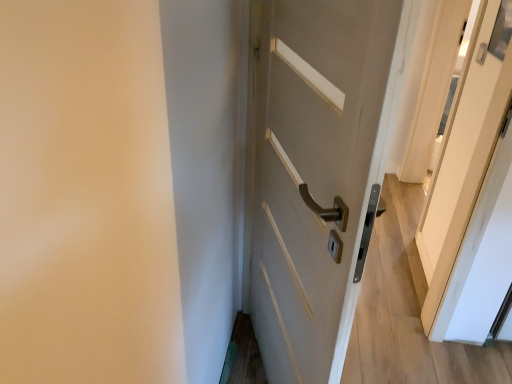
Question: Is white glossy screen door at upper right at the left side of matte white door at center?

Choices:
 (A) yes
 (B) no

Answer: (B)

Question: From a real-world perspective, does white glossy screen door at upper right sit lower than matte white door at center?

Choices:
 (A) no
 (B) yes

Answer: (B)

Question: Is white glossy screen door at upper right surrounding matte white door at center?

Choices:
 (A) no
 (B) yes

Answer: (A)

Question: Is white glossy screen door at upper right further to camera compared to matte white door at center?

Choices:
 (A) yes
 (B) no

Answer: (A)

Question: Is white glossy screen door at upper right turned away from matte white door at center?

Choices:
 (A) no
 (B) yes

Answer: (A)

Question: Can you see white glossy screen door at upper right touching matte white door at center?

Choices:
 (A) no
 (B) yes

Answer: (A)

Question: Does matte white door at center have a lesser width compared to white glossy screen door at upper right?

Choices:
 (A) no
 (B) yes

Answer: (A)

Question: Can you confirm if matte white door at center is shorter than white glossy screen door at upper right?

Choices:
 (A) yes
 (B) no

Answer: (B)

Question: From the image's perspective, does matte white door at center appear higher than white glossy screen door at upper right?

Choices:
 (A) yes
 (B) no

Answer: (B)

Question: Could you tell me if matte white door at center is facing white glossy screen door at upper right?

Choices:
 (A) no
 (B) yes

Answer: (A)

Question: Is matte white door at center positioned beyond the bounds of white glossy screen door at upper right?

Choices:
 (A) yes
 (B) no

Answer: (A)

Question: Is matte white door at center at the right side of white glossy screen door at upper right?

Choices:
 (A) no
 (B) yes

Answer: (A)

Question: Considering the positions of matte white door at center and white glossy screen door at upper right in the image, is matte white door at center wider or thinner than white glossy screen door at upper right?

Choices:
 (A) wide
 (B) thin

Answer: (A)